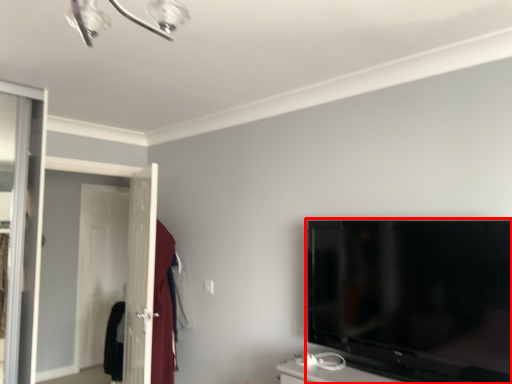
Question: From the image's perspective, where is television (annotated by the red box) located relative to screen door?

Choices:
 (A) below
 (B) above

Answer: (B)